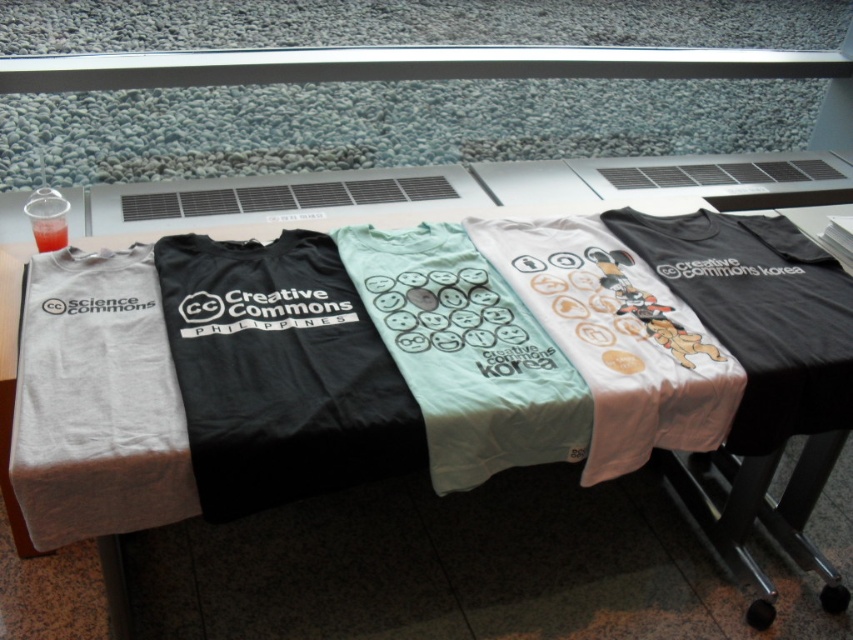
Does black matte t-shirt at center appear on the left side of light blue cotton t-shirt at center?

Indeed, black matte t-shirt at center is positioned on the left side of light blue cotton t-shirt at center.

Who is more distant from viewer, (x=233, y=340) or (x=508, y=340)?

Positioned behind is point (x=508, y=340).

Identify the location of black matte t-shirt at center. click(x=280, y=372).

Does black matte t-shirt at center have a lesser width compared to gray cotton t-shirt at left?

No, black matte t-shirt at center is not thinner than gray cotton t-shirt at left.

Is point (207, 465) positioned after point (59, 499)?

That is True.

You are a GUI agent. You are given a task and a screenshot of the screen. Output one action in this format:
    pyautogui.click(x=<x>, y=<y>)
    Task: Click on the black matte t-shirt at center
    The image size is (853, 640).
    Given the screenshot: What is the action you would take?
    pyautogui.click(x=280, y=372)

Does white cotton t-shirt at center have a lesser height compared to gray cotton t-shirt at left?

Incorrect, white cotton t-shirt at center's height does not fall short of gray cotton t-shirt at left's.

Which is above, white cotton t-shirt at center or gray cotton t-shirt at left?

gray cotton t-shirt at left is higher up.

Find the location of a particular element. white cotton t-shirt at center is located at coordinates (463, 556).

I want to click on white cotton t-shirt at center, so click(x=463, y=556).